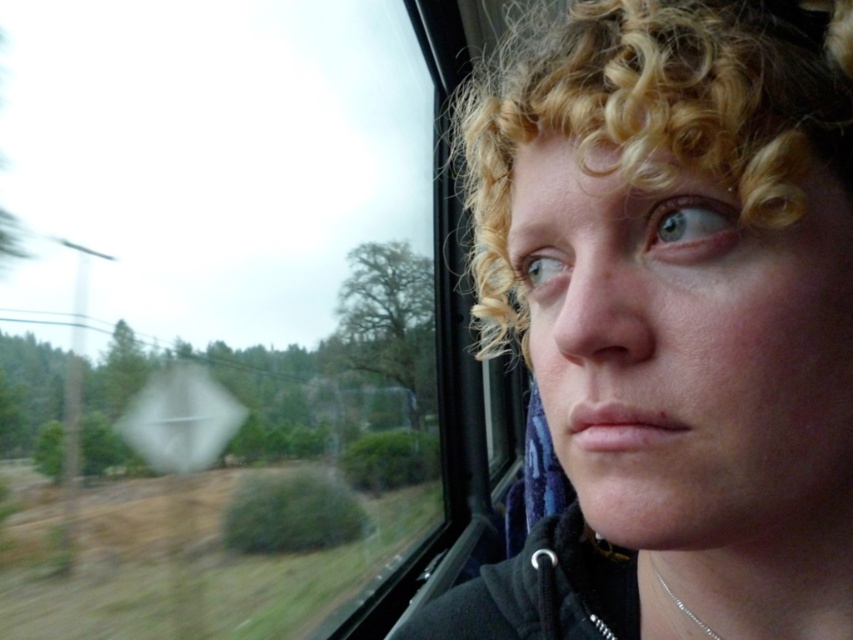
You are a passenger on a train and want to check your reflection in the window. The transparent glass train window at center is to the left of your blonde curly hair at upper right. Which object should you look at to see your reflection?

You should look at the transparent glass train window at center to see your reflection because it is a reflective surface, while the blonde curly hair at upper right is not a reflective surface.

You are a passenger on a moving train and see two points through the window. The first point is at coordinates point (367, 348), and the second is at point (573, 420). Based on the scene, which point is closer to you?

Point (573, 420) is closer to you because it is in front of point (367, 348) according to the description.

You are a passenger sitting in a train seat and looking at the transparent glass train window at center and the blonde curly hair at upper right. Which object is closer to your eyes?

The transparent glass train window at center is closer to your eyes because it is further to the viewer than the blonde curly hair at upper right.